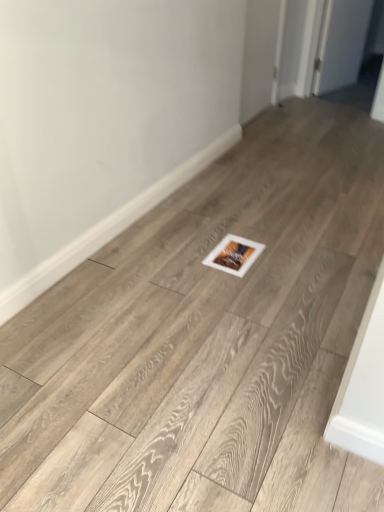
Locate an element on the screen. This screenshot has width=384, height=512. white matte picture frame at center is located at coordinates (234, 255).

This screenshot has height=512, width=384. What do you see at coordinates (234, 255) in the screenshot? I see `white matte picture frame at center` at bounding box center [234, 255].

Locate an element on the screen. The image size is (384, 512). white matte picture frame at center is located at coordinates (234, 255).